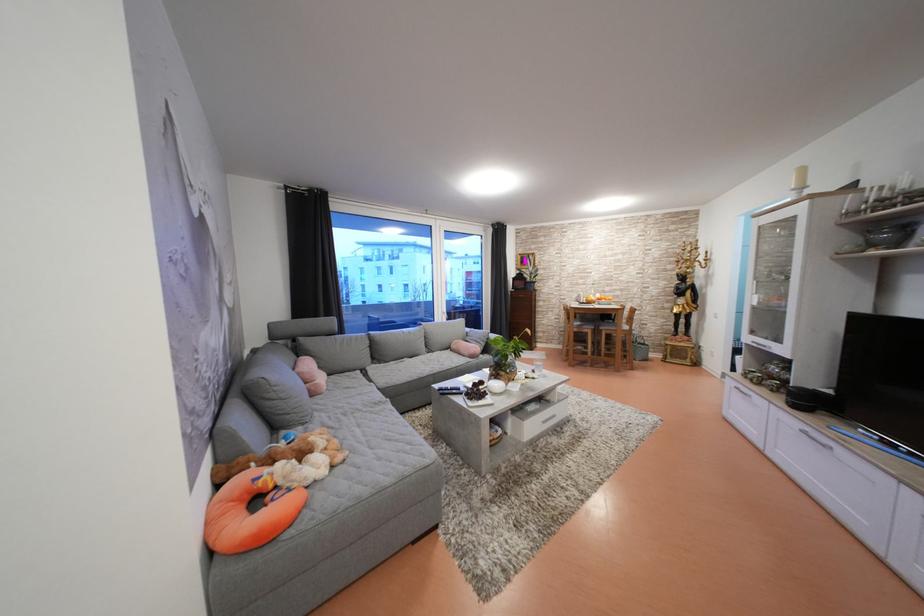
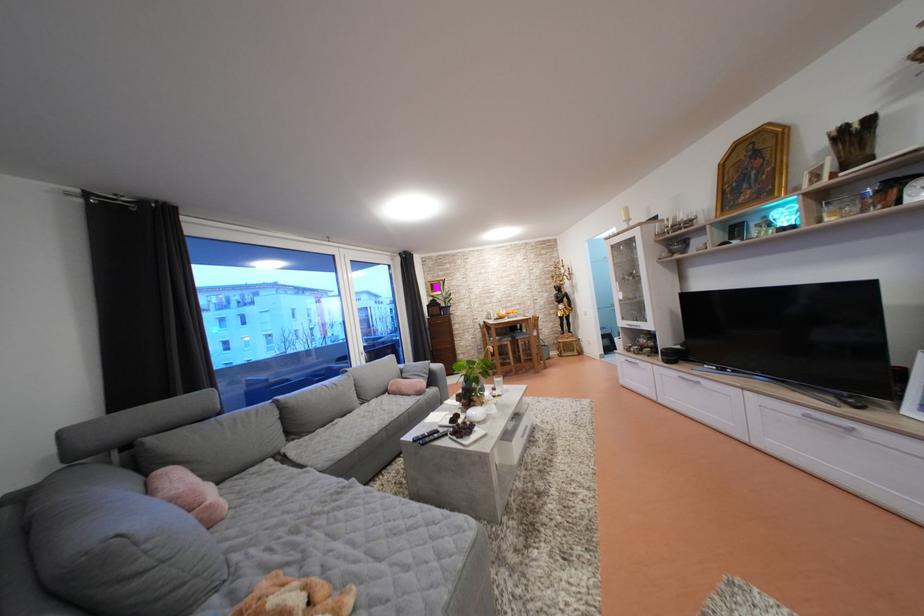
The point at (621, 325) is marked in the first image. Where is the corresponding point in the second image?

(528, 334)